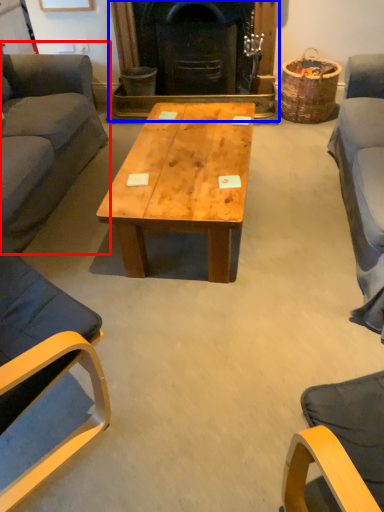
Question: Which object appears farthest to the camera in this image, studio couch (highlighted by a red box) or fireplace (highlighted by a blue box)?

Choices:
 (A) studio couch
 (B) fireplace

Answer: (B)